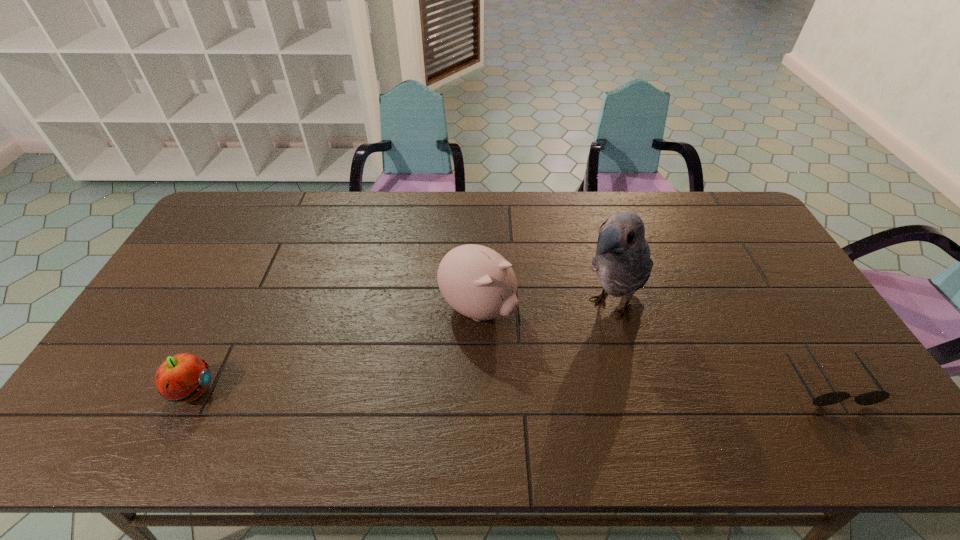
Locate an element on the screen. The height and width of the screenshot is (540, 960). vacant space located at the snout of the second object from left to right is located at coordinates (605, 397).

Where is `free region located at the snout of the second object from left to right`? This screenshot has height=540, width=960. free region located at the snout of the second object from left to right is located at coordinates (520, 337).

The image size is (960, 540). I want to click on vacant area situated 0.080m on the front-facing side of the parrot, so click(x=569, y=349).

The height and width of the screenshot is (540, 960). I want to click on vacant space positioned on the front-facing side of the parrot, so click(534, 384).

You are a GUI agent. You are given a task and a screenshot of the screen. Output one action in this format:
    pyautogui.click(x=<x>, y=<y>)
    Task: Click on the free space located 0.050m on the front-facing side of the parrot
    
    Given the screenshot: What is the action you would take?
    pyautogui.click(x=576, y=342)

At what (x,y) coordinates should I click in order to perform the action: click on apple that is at the near edge. Please return your answer as a coordinate pair (x, y). Looking at the image, I should click on (184, 377).

Find the location of a particular element. sunglasses at the near edge is located at coordinates (869, 398).

Identify the location of object that is at the right edge. This screenshot has width=960, height=540. (869, 398).

You are a GUI agent. You are given a task and a screenshot of the screen. Output one action in this format:
    pyautogui.click(x=<x>, y=<y>)
    Task: Click on the object positioned at the near right corner
    Image resolution: width=960 pixels, height=540 pixels.
    Given the screenshot: What is the action you would take?
    (x=869, y=398)

Locate an element on the screen. vacant space at the far edge of the desktop is located at coordinates (521, 216).